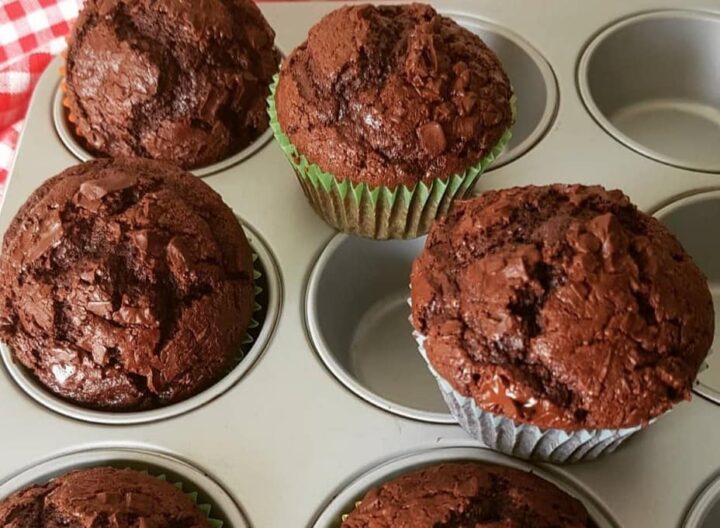
Find the location of a particular element. paper muffin holder white is located at coordinates point(479,419).